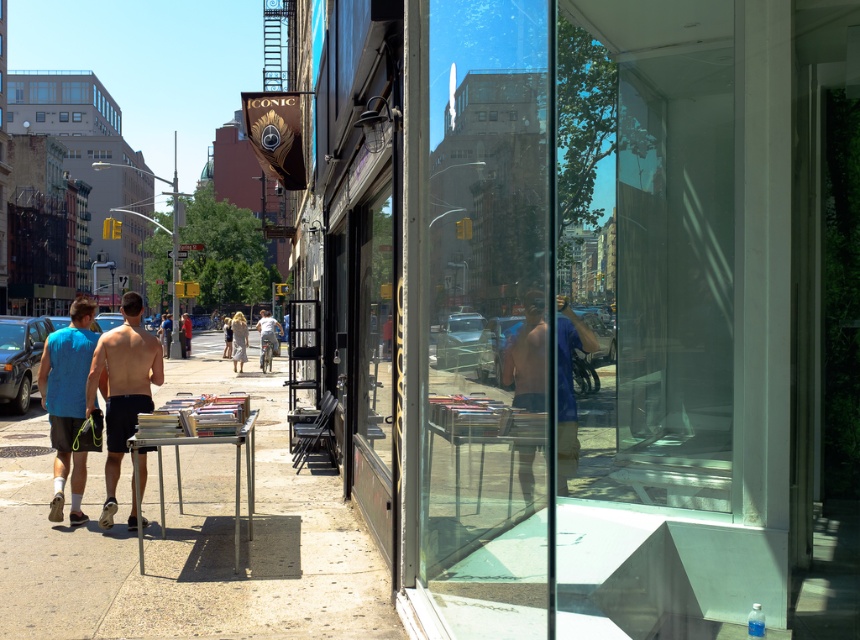
Question: Is light beige cotton dress at center smaller than light beige fabric dress at center?

Choices:
 (A) yes
 (B) no

Answer: (B)

Question: Which object is the closest to the light blue shirt at center?

Choices:
 (A) light beige cotton dress at center
 (B) shiny blue shirt at center
 (C) shiny black shorts at center

Answer: (A)

Question: Which of these objects is positioned farthest from the shiny blue shirt at center?

Choices:
 (A) light beige cotton dress at center
 (B) shiny black shorts at center

Answer: (A)

Question: Is shiny blue shirt at center below shiny black shorts at center?

Choices:
 (A) yes
 (B) no

Answer: (B)

Question: Does shiny blue shirt at center have a smaller size compared to light beige fabric dress at center?

Choices:
 (A) no
 (B) yes

Answer: (B)

Question: Among these points, which one is nearest to the camera?

Choices:
 (A) (238, 556)
 (B) (527, 492)
 (C) (244, 323)

Answer: (B)